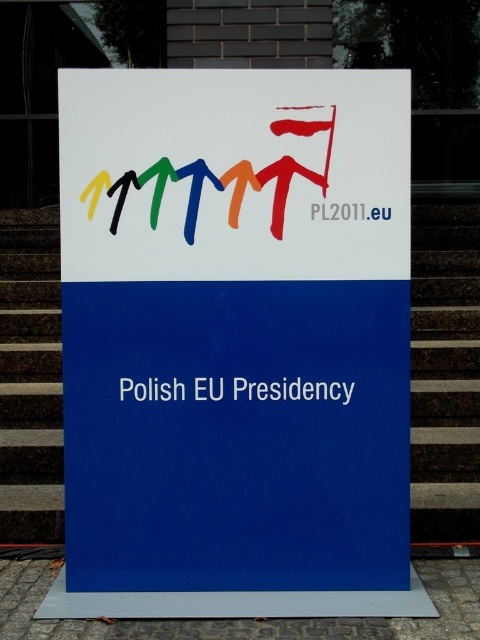
You are a delivery person who needs to attach a sticker to the signboard. The sticker requires a space wider than the multicolored plastic logo at center. Is there enough space on the white paper sign at center for the sticker?

The white paper sign at center is wider than the multicolored plastic logo at center, so there is enough space to attach the sticker.